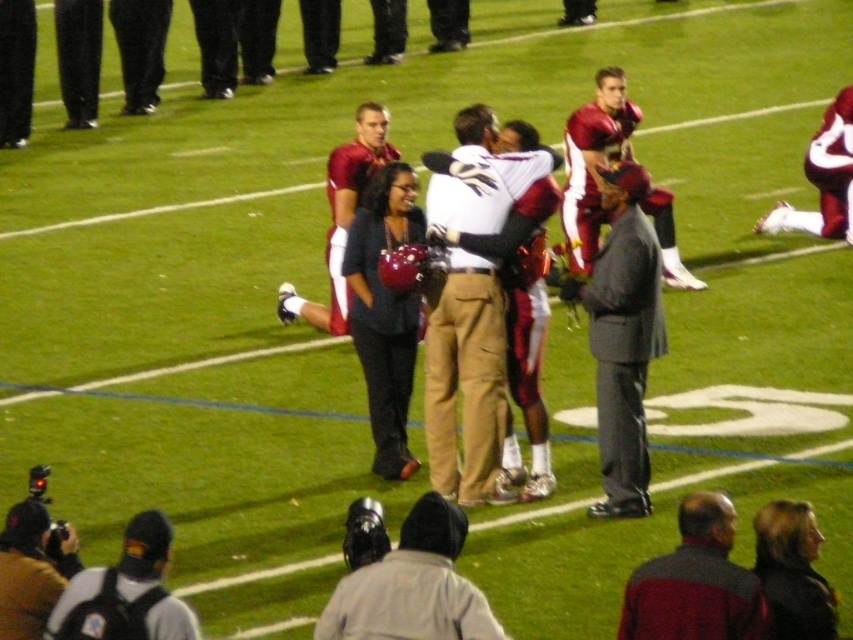
Between maroon fabric uniform at center and dark gray jacket at center, which one appears on the right side from the viewer's perspective?

Positioned to the right is maroon fabric uniform at center.

The width and height of the screenshot is (853, 640). I want to click on maroon fabric uniform at center, so click(595, 160).

Where is `maroon fabric uniform at center`? maroon fabric uniform at center is located at coordinates (595, 160).

Locate an element on the screen. gray suit at center is located at coordinates (624, 339).

Does point (634, 497) come behind point (647, 566)?

Yes, point (634, 497) is farther from viewer.

Is point (631, 172) closer to viewer compared to point (720, 545)?

No.

Identify the location of gray suit at center. The image size is (853, 640). (624, 339).

Can you confirm if gray suit at center is smaller than matte black camera at lower left?

No.

This screenshot has height=640, width=853. What do you see at coordinates (624, 339) in the screenshot?
I see `gray suit at center` at bounding box center [624, 339].

Who is more forward, (648,257) or (19,509)?

Point (19,509) is more forward.

At what (x,y) coordinates should I click in order to perform the action: click on gray suit at center. Please return your answer as a coordinate pair (x, y). This screenshot has height=640, width=853. Looking at the image, I should click on (624, 339).